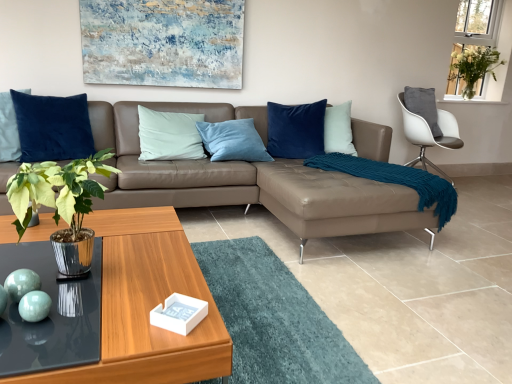
You are a GUI agent. You are given a task and a screenshot of the screen. Output one action in this format:
    pyautogui.click(x=<x>, y=<y>)
    Task: Click on the vacant area that is situated to the right of teal glossy spheres at lower left, marked as the 2th teal in a right-to-left arrangement
    Image resolution: width=512 pixels, height=384 pixels.
    Given the screenshot: What is the action you would take?
    click(x=83, y=301)